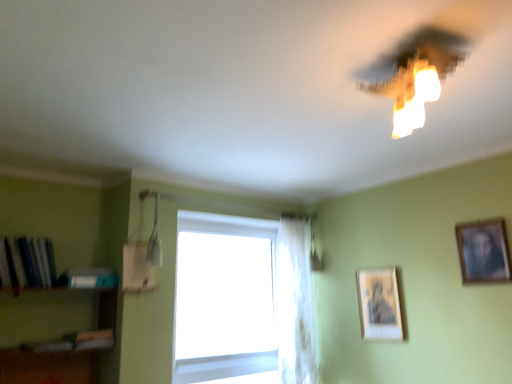
Question: From a real-world perspective, is shiny blue book at left, positioned as the 1th book in left-to-right order, on top of white sheer curtain at center?

Choices:
 (A) no
 (B) yes

Answer: (B)

Question: Does shiny blue book at left, positioned as the 1th book in left-to-right order, come in front of white sheer curtain at center?

Choices:
 (A) yes
 (B) no

Answer: (A)

Question: Does shiny blue book at left, marked as the second book in a right-to-left arrangement, appear on the right side of white sheer curtain at center?

Choices:
 (A) no
 (B) yes

Answer: (A)

Question: Could white sheer curtain at center be considered to be inside shiny blue book at left, positioned as the 1th book in left-to-right order?

Choices:
 (A) yes
 (B) no

Answer: (B)

Question: Are shiny blue book at left, marked as the second book in a right-to-left arrangement, and white sheer curtain at center making contact?

Choices:
 (A) yes
 (B) no

Answer: (B)

Question: From a real-world perspective, does shiny blue book at left, marked as the second book in a right-to-left arrangement, sit lower than white sheer curtain at center?

Choices:
 (A) yes
 (B) no

Answer: (B)

Question: Considering the relative sizes of matte white light fixture at upper right and shiny blue book at left, positioned as the 1th book in left-to-right order, in the image provided, is matte white light fixture at upper right smaller than shiny blue book at left, positioned as the 1th book in left-to-right order,?

Choices:
 (A) no
 (B) yes

Answer: (A)

Question: Is there a large distance between matte white light fixture at upper right and shiny blue book at left, marked as the second book in a right-to-left arrangement?

Choices:
 (A) yes
 (B) no

Answer: (A)

Question: From the image's perspective, does matte white light fixture at upper right appear higher than shiny blue book at left, marked as the second book in a right-to-left arrangement?

Choices:
 (A) yes
 (B) no

Answer: (A)

Question: Is matte white light fixture at upper right oriented away from shiny blue book at left, positioned as the 1th book in left-to-right order?

Choices:
 (A) yes
 (B) no

Answer: (B)

Question: Is matte white light fixture at upper right in front of shiny blue book at left, marked as the second book in a right-to-left arrangement?

Choices:
 (A) no
 (B) yes

Answer: (B)

Question: From a real-world perspective, does matte white light fixture at upper right sit lower than shiny blue book at left, positioned as the 1th book in left-to-right order?

Choices:
 (A) no
 (B) yes

Answer: (A)

Question: Can you confirm if hardcover book at left, arranged as the 1th book when viewed from the right, is bigger than matte gold picture frame at center-right, which is counted as the 2th picture frame, starting from the right?

Choices:
 (A) yes
 (B) no

Answer: (B)